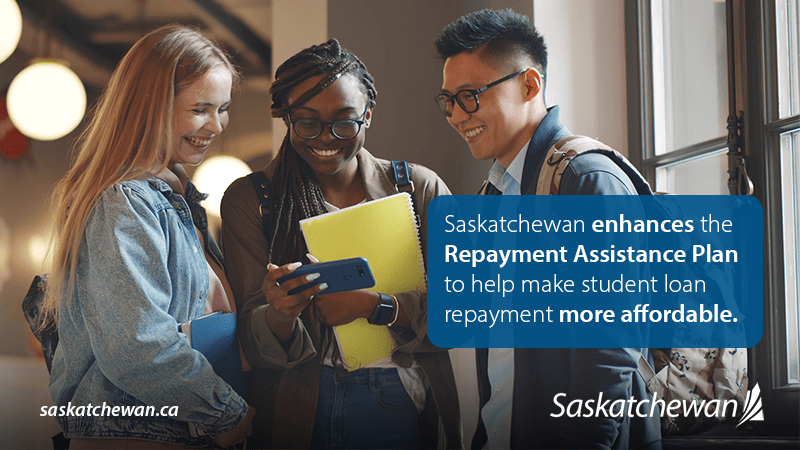
The width and height of the screenshot is (800, 450). What are the coordinates of `windows` in the screenshot? It's located at tap(696, 94), tap(690, 173), tap(778, 53), tap(788, 185).